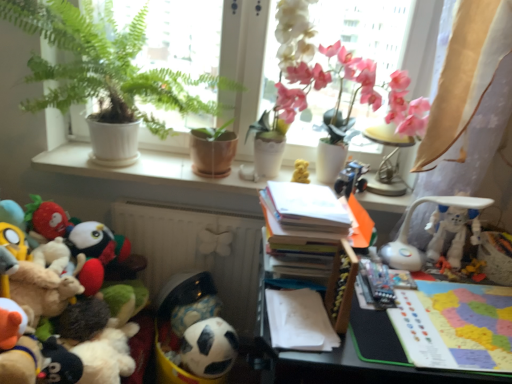
This screenshot has width=512, height=384. Find the location of `blank area to the left of white plastic robot at right, which appears as the first toy when viewed from the right`. blank area to the left of white plastic robot at right, which appears as the first toy when viewed from the right is located at coordinates (404, 263).